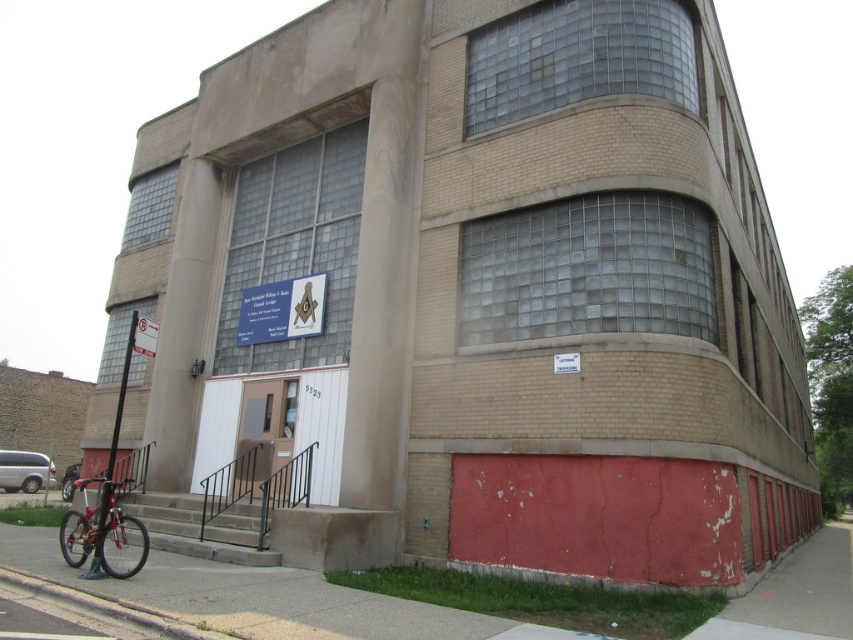
You are standing 10 feet away from the entrance of the building. If you walk straight towards the entrance, will you reach the point at coordinates point [309,324] before reaching the entrance?

The point at coordinates point [309,324] is 41.98 feet away from the viewer. Since you are only walking 10 feet towards the entrance, you will not reach the point at coordinates point [309,324] before reaching the entrance.

Based on the photo, you are standing at the base of the building and want to locate the white matte sign at center. According to the architectural layout, where should you look relative to the entrance?

The white matte sign at center is located at point [281,310], which is near the center of the building facade. Since the entrance has a brown door with a white panel on the right side, the white matte sign at center is likely positioned above the entrance.